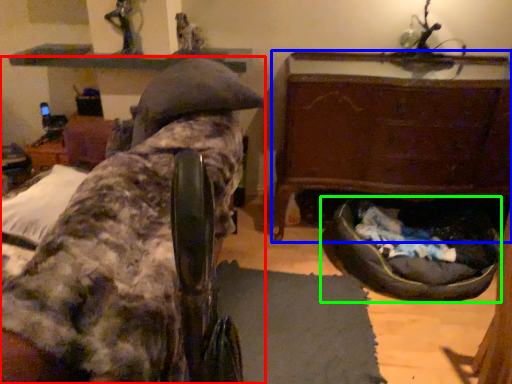
Question: Estimate the real-world distances between objects in this image. Which object is closer to furniture (highlighted by a red box), furniture (highlighted by a blue box) or dog bed (highlighted by a green box)?

Choices:
 (A) furniture
 (B) dog bed

Answer: (A)